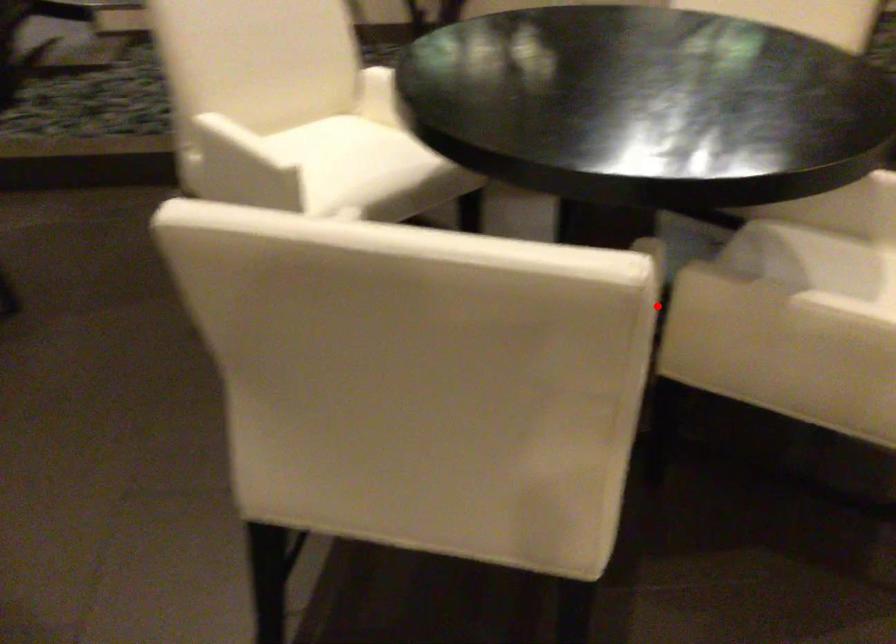
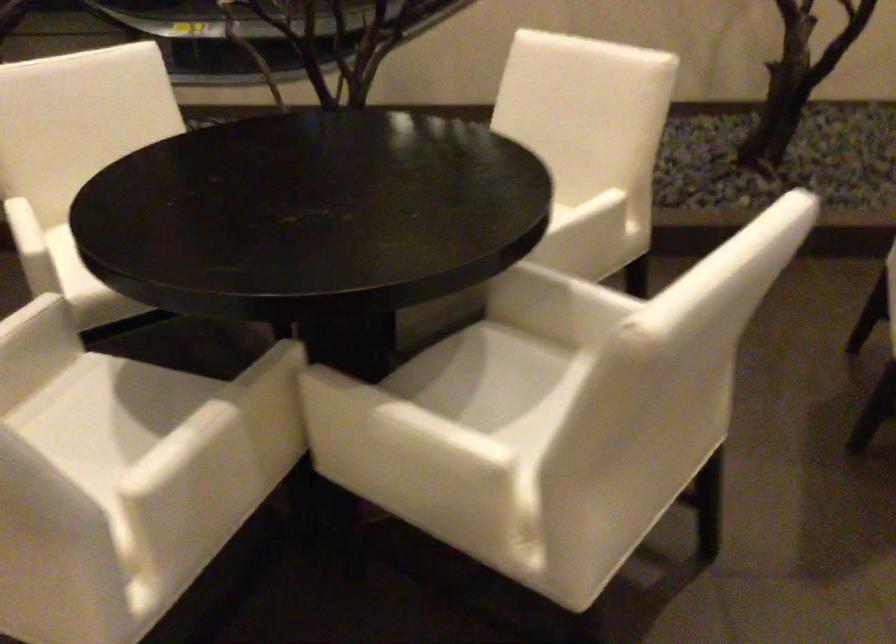
Question: I am providing you with two images of the same scene from different viewpoints. Image1 has a red point marked. In image2, the corresponding 3D location appears at what relative position? Reply with the corresponding letter.

Choices:
 (A) Closer
 (B) Farther

Answer: (B)